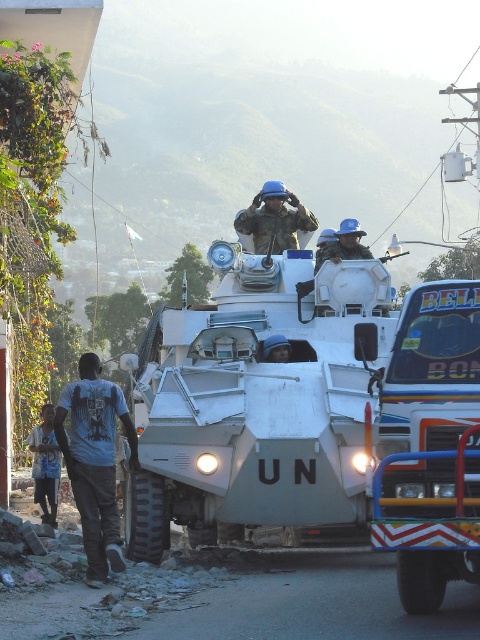
Consider the image. Is metallic painted truck at right closer to the viewer compared to matte blue helmet at center?

Yes, metallic painted truck at right is in front of matte blue helmet at center.

Which is above, metallic painted truck at right or matte blue helmet at center?

matte blue helmet at center is above.

Is point (478, 392) more distant than point (267, 348)?

No.

Locate an element on the screen. metallic painted truck at right is located at coordinates (431, 444).

Does metallic painted truck at right appear under dark blue t-shirt at left?

No.

Is point (431, 560) positioned behind point (81, 509)?

That is False.

At what (x,y) coordinates should I click in order to perform the action: click on metallic painted truck at right. Please return your answer as a coordinate pair (x, y). The width and height of the screenshot is (480, 640). Looking at the image, I should click on (431, 444).

Who is lower down, metallic painted truck at right or blue matte helmet at center?

metallic painted truck at right is below.

Is metallic painted truck at right to the left of blue matte helmet at center from the viewer's perspective?

No, metallic painted truck at right is not to the left of blue matte helmet at center.

Who is more forward, (406, 349) or (279, 195)?

Positioned in front is point (406, 349).

At what (x,y) coordinates should I click in order to perform the action: click on metallic painted truck at right. Please return your answer as a coordinate pair (x, y). This screenshot has width=480, height=640. Looking at the image, I should click on (431, 444).